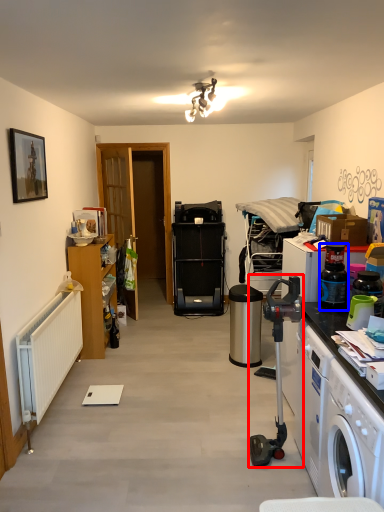
Question: Which of the following is the closest to the observer, appliance (highlighted by a red box) or bottle (highlighted by a blue box)?

Choices:
 (A) appliance
 (B) bottle

Answer: (A)